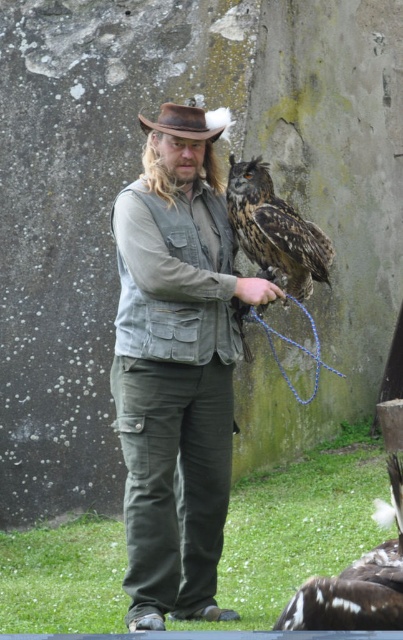
You are a photographer trying to capture the owl on the man. You notice the brown speckled feathers at center and the denim vest at center. Which object is closer to you, the photographer?

The brown speckled feathers at center is closer to you than the denim vest at center.

In the scene shown: You are a photographer trying to capture the owl on the man. You notice the brown speckled feathers at center and the denim vest at center. Which object is positioned higher on the man?

The brown speckled feathers at center is located above denim vest at center, so the brown speckled feathers at center is positioned higher on the man.